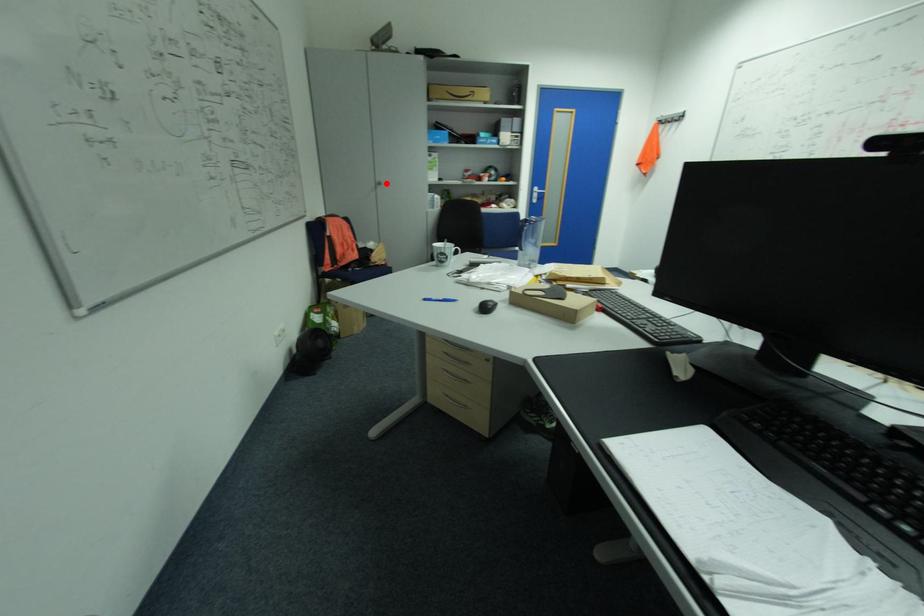
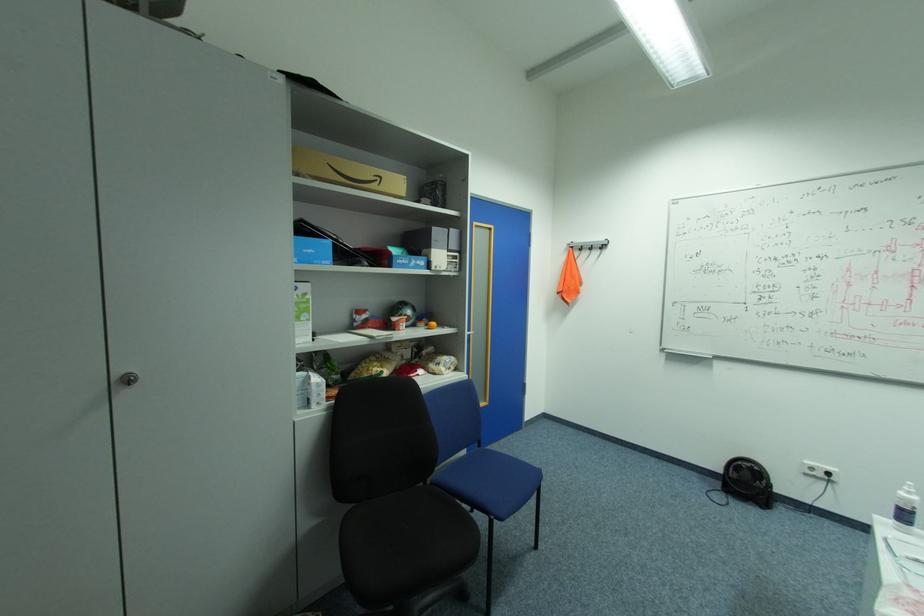
The point at the highlighted location is marked in the first image. Where is the corresponding point in the second image?

(137, 379)